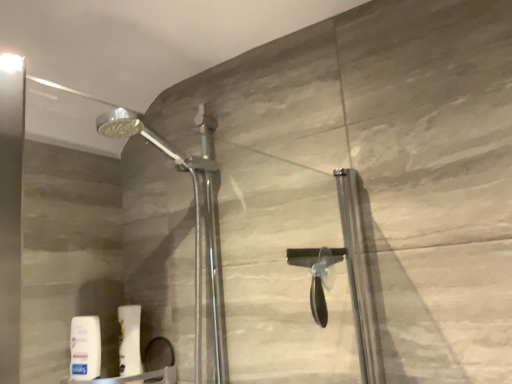
Question: Is white matte tube at lower left, the first toiletry positioned from the right, aimed at white matte lotion at lower left, arranged as the first toiletry when viewed from the left?

Choices:
 (A) yes
 (B) no

Answer: (B)

Question: Does white matte tube at lower left, the first toiletry positioned from the right, have a greater width compared to white matte lotion at lower left, arranged as the first toiletry when viewed from the left?

Choices:
 (A) yes
 (B) no

Answer: (A)

Question: Is white matte tube at lower left, the second toiletry in the left-to-right sequence, not near white matte lotion at lower left, which is the second toiletry in right-to-left order?

Choices:
 (A) yes
 (B) no

Answer: (B)

Question: Can you confirm if white matte tube at lower left, the first toiletry positioned from the right, is shorter than white matte lotion at lower left, arranged as the first toiletry when viewed from the left?

Choices:
 (A) yes
 (B) no

Answer: (B)

Question: Does white matte tube at lower left, the second toiletry in the left-to-right sequence, appear on the right side of white matte lotion at lower left, arranged as the first toiletry when viewed from the left?

Choices:
 (A) yes
 (B) no

Answer: (A)

Question: From the image's perspective, does white matte tube at lower left, the second toiletry in the left-to-right sequence, appear lower than white matte lotion at lower left, which is the second toiletry in right-to-left order?

Choices:
 (A) no
 (B) yes

Answer: (A)

Question: Does white matte tube at lower left, the first toiletry positioned from the right, lie in front of transparent glass door at center?

Choices:
 (A) yes
 (B) no

Answer: (B)

Question: From a real-world perspective, is white matte tube at lower left, the second toiletry in the left-to-right sequence, on transparent glass door at center?

Choices:
 (A) no
 (B) yes

Answer: (A)

Question: Does white matte tube at lower left, the first toiletry positioned from the right, lie behind transparent glass door at center?

Choices:
 (A) no
 (B) yes

Answer: (B)

Question: Is white matte tube at lower left, the second toiletry in the left-to-right sequence, wider than transparent glass door at center?

Choices:
 (A) yes
 (B) no

Answer: (B)

Question: Is transparent glass door at center inside white matte tube at lower left, the second toiletry in the left-to-right sequence?

Choices:
 (A) no
 (B) yes

Answer: (A)

Question: Considering the relative sizes of white matte tube at lower left, the second toiletry in the left-to-right sequence, and transparent glass door at center in the image provided, is white matte tube at lower left, the second toiletry in the left-to-right sequence, taller than transparent glass door at center?

Choices:
 (A) yes
 (B) no

Answer: (B)

Question: Does white matte lotion at lower left, arranged as the first toiletry when viewed from the left, have a greater width compared to transparent glass door at center?

Choices:
 (A) yes
 (B) no

Answer: (B)